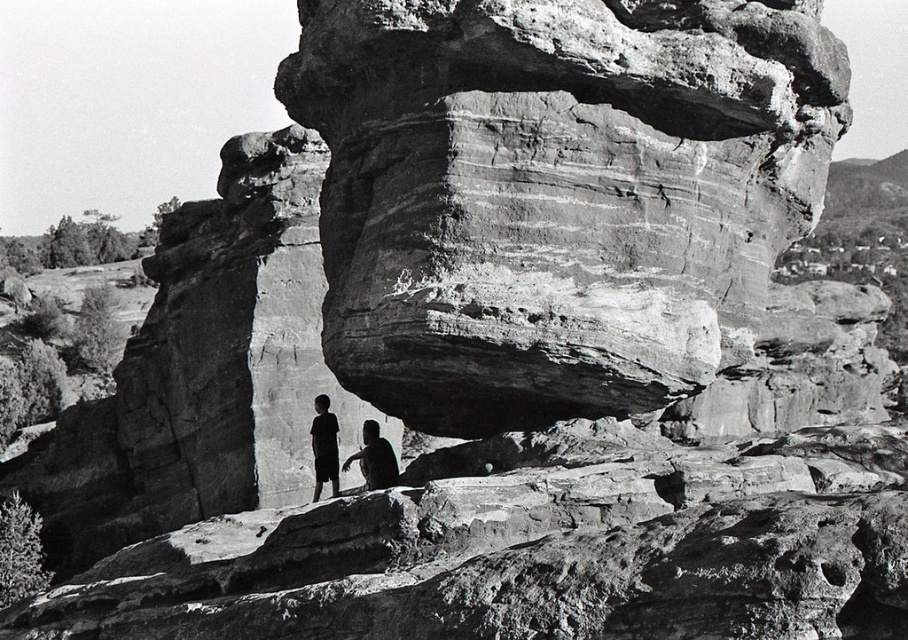
You are planning to take a photo of the dark clothing figure at center and the dark skin textured person at lower center. Which of them should you position closer to the camera to ensure both appear equally sized in the photo?

You should position the dark skin textured person at lower center closer to the camera because their actual width is smaller than the dark clothing figure at center, so moving them closer can make them appear the same size in the photo.

In the scene shown: You are a photographer planning to take a group photo of the dark clothing figure at center and the dark skin textured person at lower center. The camera you are using has a maximum focus range of 1.5 meters. Will both figures be in focus if you position the camera to capture both?

The dark clothing figure at center and the dark skin textured person at lower center are 1.39 meters apart, so yes, both figures will be in focus since the distance between them is within the camera maximum focus range of 1.5 meters.

You are a photographer planning to capture the dramatic rock formation at the center of the image. You notice a specific point marked at coordinates point (555, 193). Based on the scene description, where exactly is this point located?

The point (555, 193) is located on the rugged stone arch at center.